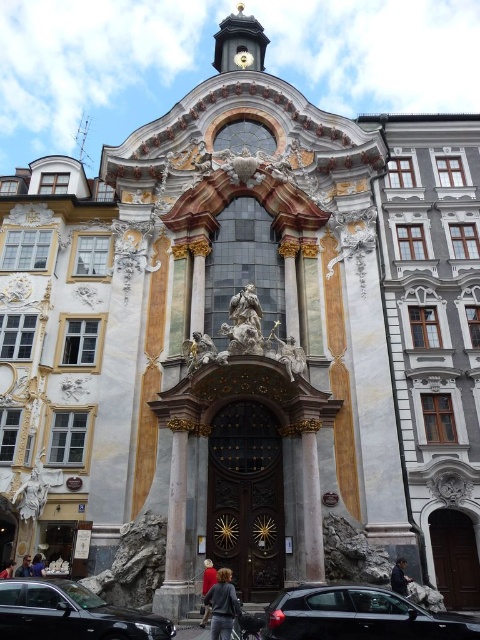
You are standing in front of the church and notice two items in the scene. One is the dark blue fabric at center and the other is the dark brown leather jacket at lower left. Which item would appear larger to you?

The dark blue fabric at center appears larger because it is closer to the viewer than the dark brown leather jacket at lower left.

You are standing in front of the church and notice two fabrics displayed on the facade. The red fabric at center and the dark blue fabric at center. Which fabric appears closer to you?

The red fabric at center is closer to the viewer than the dark blue fabric at center.

You are standing in front of the Baroque church and want to reach the point marked at coordinates point (210, 572). If your maximum comfortable walking distance is 200 feet, can you comfortably walk to that point without feeling too tired?

The point (210, 572) is 177.28 feet away from the viewer. Since this distance is within your maximum comfortable walking distance of 200 feet, you can comfortably walk to that point without feeling too tired.